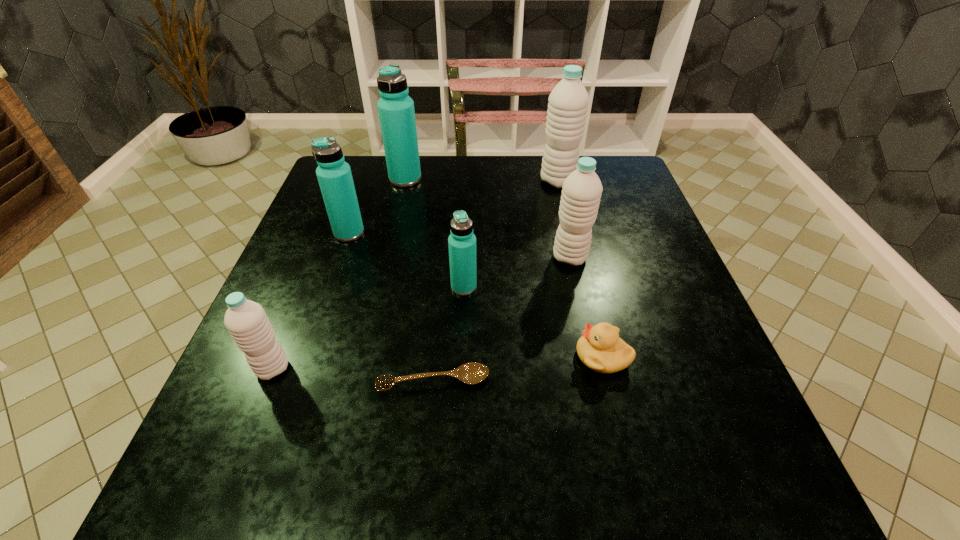
Locate an element on the screen. The height and width of the screenshot is (540, 960). the nearest white water bottle is located at coordinates (x=246, y=321).

Locate an element on the screen. Image resolution: width=960 pixels, height=540 pixels. the second shortest object is located at coordinates (600, 348).

At what (x,y) coordinates should I click in order to perform the action: click on yellow duckling. Please return your answer as a coordinate pair (x, y). Image resolution: width=960 pixels, height=540 pixels. Looking at the image, I should click on (600, 348).

You are a GUI agent. You are given a task and a screenshot of the screen. Output one action in this format:
    pyautogui.click(x=<x>, y=<y>)
    Task: Click on the ladle
    The width and height of the screenshot is (960, 540).
    Given the screenshot: What is the action you would take?
    pyautogui.click(x=470, y=373)

Find the location of a particular element. free space located on the left of the biggest white water bottle is located at coordinates (402, 181).

You are a GUI agent. You are given a task and a screenshot of the screen. Output one action in this format:
    pyautogui.click(x=<x>, y=<y>)
    Task: Click on the free space located 0.070m on the front of the second blue water bottle from left to right
    The image size is (960, 540).
    Given the screenshot: What is the action you would take?
    pyautogui.click(x=400, y=203)

Where is `vacant space situated on the left of the second smallest blue water bottle`? The image size is (960, 540). vacant space situated on the left of the second smallest blue water bottle is located at coordinates (313, 233).

Where is `vacant region located 0.050m on the front of the fourth farthest object`? vacant region located 0.050m on the front of the fourth farthest object is located at coordinates (576, 285).

Locate an element on the screen. The image size is (960, 540). vacant position located 0.400m on the back of the third water bottle from right to left is located at coordinates (468, 178).

Identify the location of vacant space located on the back of the nearest water bottle. The height and width of the screenshot is (540, 960). (313, 268).